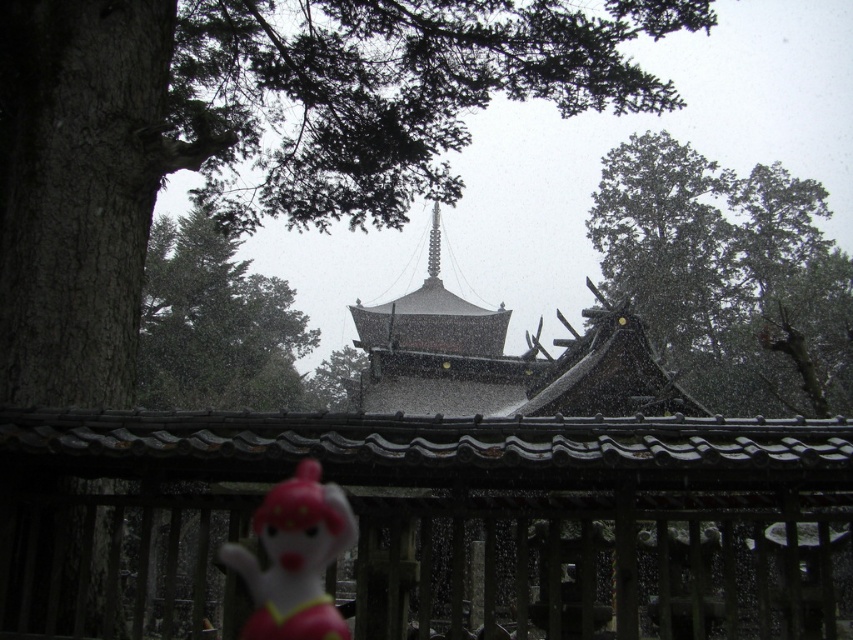
You are standing in front of the wooden fence and want to walk towards the pagoda. There are two points marked on the ground ahead of you at coordinates point [813,324] and point [254,532]. Which point will you reach first?

You will reach point [813,324] first because it is closer to you than point [254,532], which is further away.

In the scene shown: You are a photographer trying to capture the pink rubber monkey at lower left and the green leafy tree at upper center in a single shot. Based on their positions, which object would appear closer to the camera in the photo?

The pink rubber monkey at lower left is positioned closer to the camera than the green leafy tree at upper center, so it would appear closer in the photo.